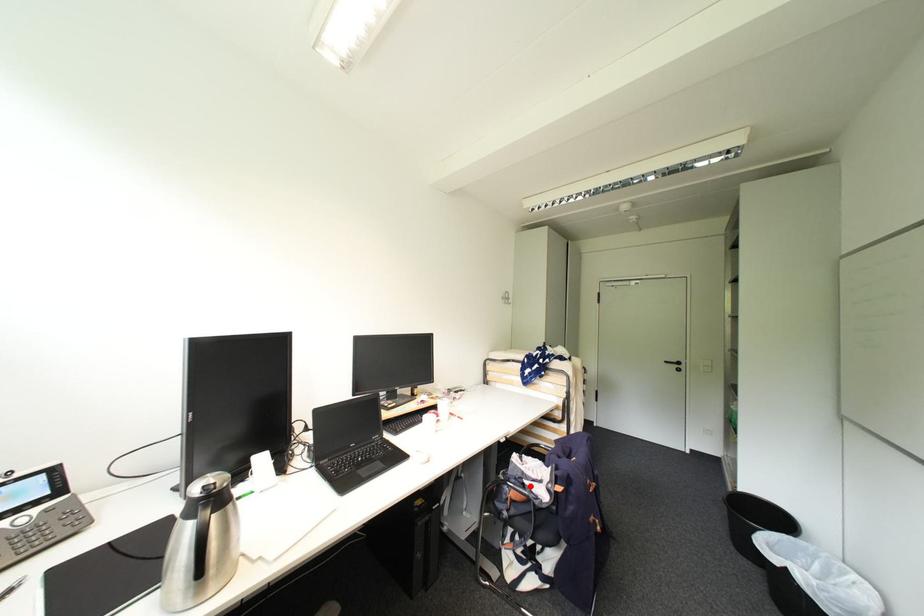
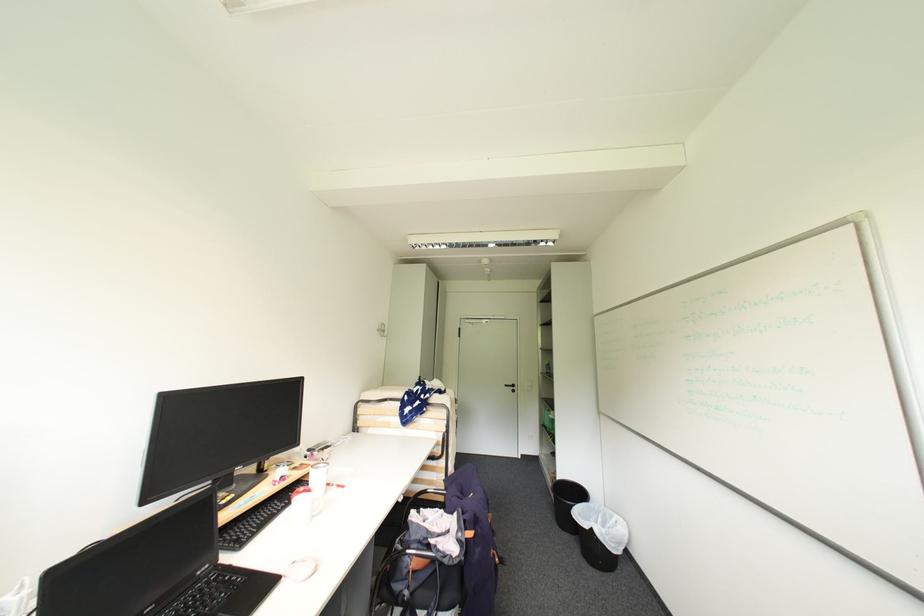
The point at the highlighted location is marked in the first image. Where is the corresponding point in the second image?

(435, 548)